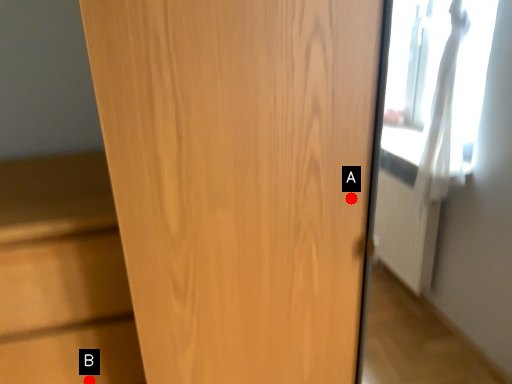
Question: Two points are circled on the image, labeled by A and B beside each circle. Among these points, which one is nearest to the camera?

Choices:
 (A) A is closer
 (B) B is closer

Answer: (A)